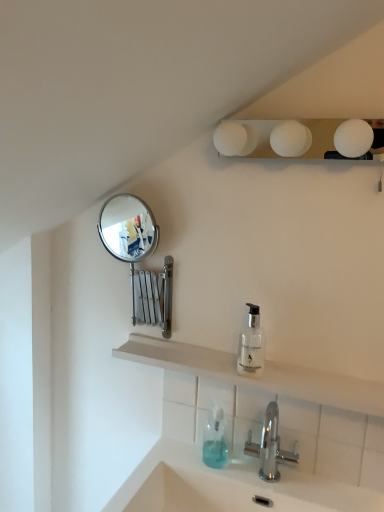
Where is `vacant point to the left of translucent plastic soap dispenser at lower center, placed as the first soap dispenser when sorted from bottom to top`? The height and width of the screenshot is (512, 384). vacant point to the left of translucent plastic soap dispenser at lower center, placed as the first soap dispenser when sorted from bottom to top is located at coordinates (178, 456).